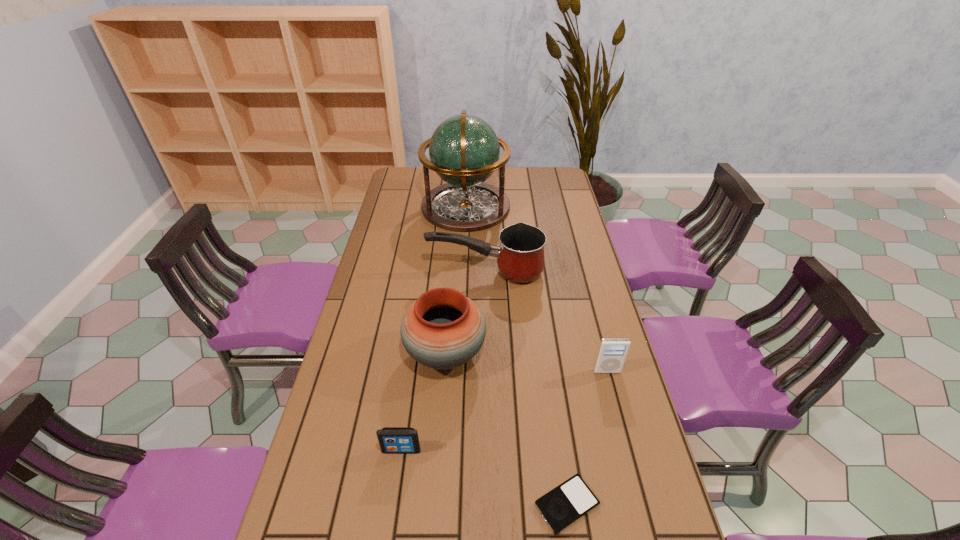
What are the coordinates of `free space at the far edge of the desktop` in the screenshot? It's located at coord(529,174).

You are a GUI agent. You are given a task and a screenshot of the screen. Output one action in this format:
    pyautogui.click(x=<x>, y=<y>)
    Task: Click on the free space at the left edge
    The image size is (960, 540).
    Given the screenshot: What is the action you would take?
    pyautogui.click(x=408, y=223)

At what (x,y) coordinates should I click in order to perform the action: click on blank space at the right edge of the desktop. Please return your answer as a coordinate pair (x, y). The width and height of the screenshot is (960, 540). Looking at the image, I should click on (553, 256).

At what (x,y) coordinates should I click in order to perform the action: click on empty location between the pottery and the nearest iPod. Please return your answer as a coordinate pair (x, y). This screenshot has height=540, width=960. Looking at the image, I should click on (506, 429).

Identify the location of free space that is in between the nearest iPod and the rightmost iPod. (587, 438).

Locate an element on the screen. free spot between the second iPod from left to right and the second shortest object is located at coordinates (484, 477).

This screenshot has height=540, width=960. What are the coordinates of `free spot between the globe and the rightmost object` in the screenshot? It's located at (x=537, y=289).

Locate an element on the screen. The width and height of the screenshot is (960, 540). unoccupied area between the pottery and the rightmost object is located at coordinates (526, 362).

What are the coordinates of `free space between the tallest object and the rightmost iPod` in the screenshot? It's located at (537, 289).

The image size is (960, 540). What are the coordinates of `object that stands as the fifth closest to the second iPod from left to right` in the screenshot? It's located at (464, 151).